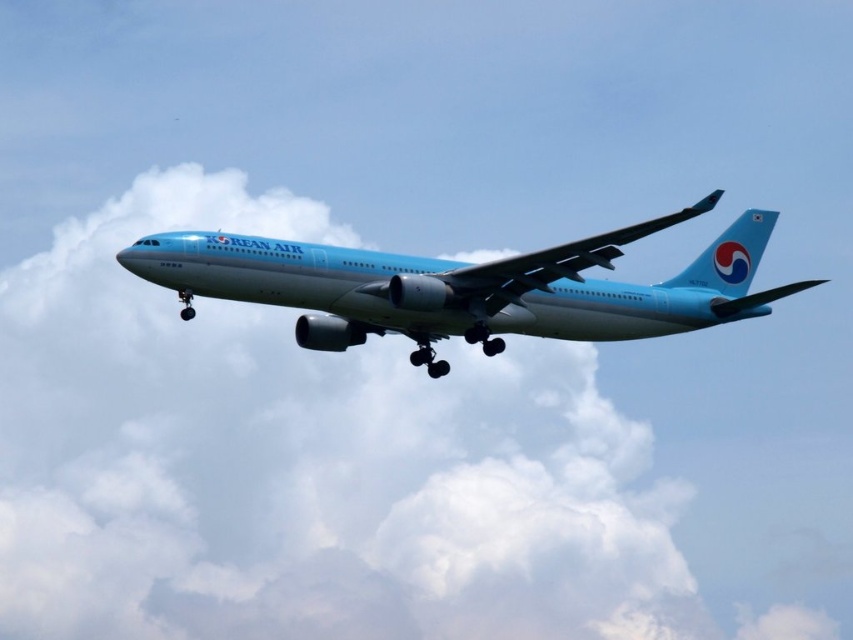
How much distance is there between white fluffy cloud at upper center and light blue metallic airplane at center?

white fluffy cloud at upper center and light blue metallic airplane at center are 512.51 feet apart.

Can you confirm if white fluffy cloud at upper center is taller than light blue metallic airplane at center?

Yes.

Between point (195, 524) and point (601, 328), which one is positioned behind?

The point (195, 524) is behind.

This screenshot has height=640, width=853. Identify the location of white fluffy cloud at upper center. (305, 461).